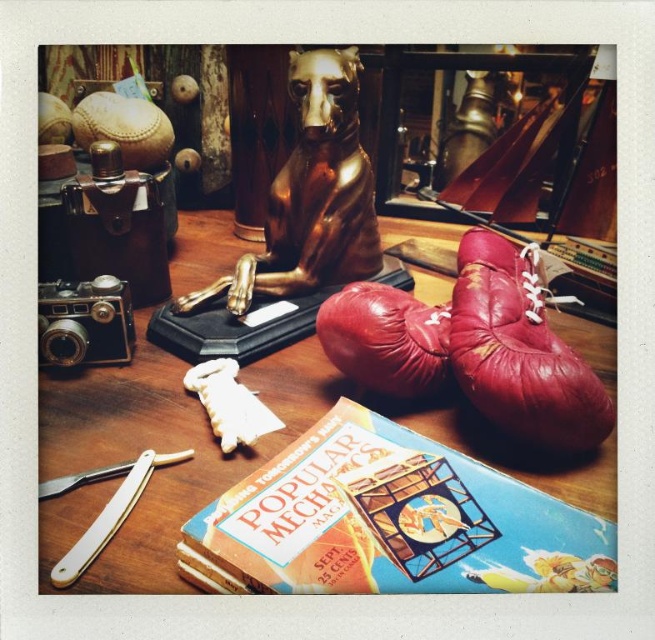
Based on the photo, is wooden table at center wider than gold shiny statue at center?

Indeed, wooden table at center has a greater width compared to gold shiny statue at center.

From the picture: Is wooden table at center shorter than gold shiny statue at center?

No.

In order to click on wooden table at center in this screenshot , I will do `click(132, 454)`.

At what (x,y) coordinates should I click in order to perform the action: click on wooden table at center. Please return your answer as a coordinate pair (x, y). Looking at the image, I should click on (132, 454).

Does gold shiny statue at center appear under white plastic razor at lower left?

Incorrect, gold shiny statue at center is not positioned below white plastic razor at lower left.

Where is `gold shiny statue at center`? Image resolution: width=655 pixels, height=640 pixels. gold shiny statue at center is located at coordinates (310, 195).

Between wooden table at center and white plastic razor at lower left, which one appears on the right side from the viewer's perspective?

wooden table at center is more to the right.

Does wooden table at center appear over white plastic razor at lower left?

Yes, wooden table at center is above white plastic razor at lower left.

Who is more distant from viewer, (424, 426) or (39, 486)?

Positioned behind is point (424, 426).

The height and width of the screenshot is (640, 655). I want to click on wooden table at center, so click(x=132, y=454).